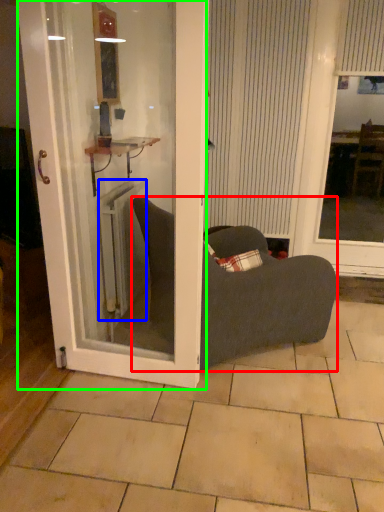
Question: Based on their relative distances, which object is nearer to chair (highlighted by a red box)? Choose from radiator (highlighted by a blue box) and door (highlighted by a green box).

Choices:
 (A) radiator
 (B) door

Answer: (B)